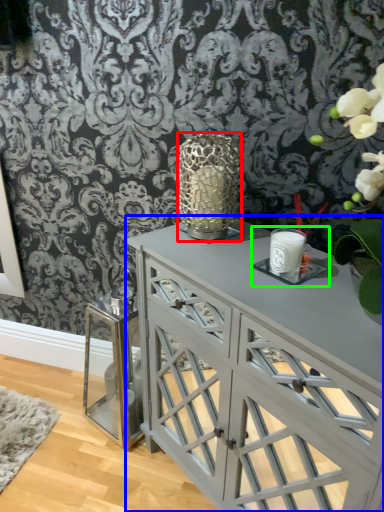
Question: Which object is positioned farthest from candle holder (highlighted by a red box)? Select from table (highlighted by a blue box) and candle holder (highlighted by a green box).

Choices:
 (A) table
 (B) candle holder

Answer: (A)